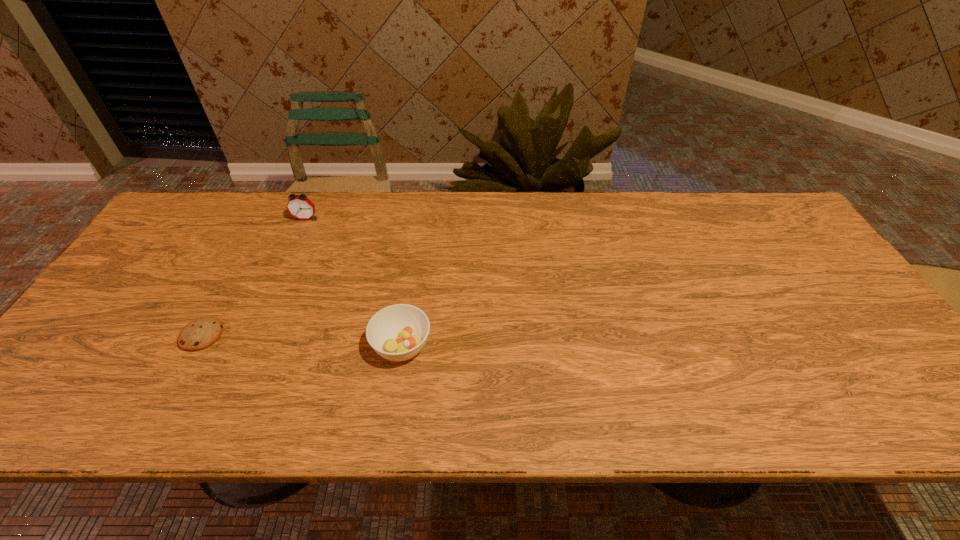
Identify the location of vacant space at the far edge of the desktop. This screenshot has width=960, height=540. (503, 222).

Where is `free spot at the near edge of the desktop`? The width and height of the screenshot is (960, 540). free spot at the near edge of the desktop is located at coordinates pyautogui.click(x=676, y=393).

Identify the location of blank area at the right edge. Image resolution: width=960 pixels, height=540 pixels. (x=764, y=245).

In the image, there is a desktop. Where is `vacant space at the near left corner`? vacant space at the near left corner is located at coordinates (101, 406).

Where is `vacant region between the soup bowl and the alarm clock`? The width and height of the screenshot is (960, 540). vacant region between the soup bowl and the alarm clock is located at coordinates (353, 282).

Locate an element on the screen. unoccupied area between the leftmost object and the second object from right to left is located at coordinates (253, 277).

At what (x,y) coordinates should I click in order to perform the action: click on vacant space in between the tallest object and the second shortest object. Please return your answer as a coordinate pair (x, y). The image size is (960, 540). Looking at the image, I should click on (353, 282).

This screenshot has height=540, width=960. What are the coordinates of `vacant area that lies between the cookie and the soup bowl` in the screenshot? It's located at [x=301, y=341].

Find the location of a particular element. blank region between the leftmost object and the farthest object is located at coordinates (253, 277).

The height and width of the screenshot is (540, 960). What are the coordinates of `free spot between the second shortest object and the cookie` in the screenshot? It's located at (301, 341).